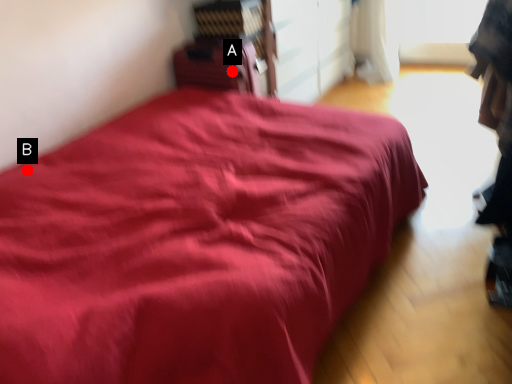
Question: Two points are circled on the image, labeled by A and B beside each circle. Among these points, which one is nearest to the camera?

Choices:
 (A) A is closer
 (B) B is closer

Answer: (B)